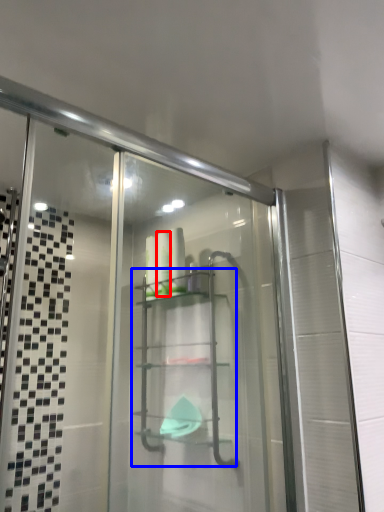
Question: Which point is closer to the camera, toiletry (highlighted by a red box) or glass box (highlighted by a blue box)?

Choices:
 (A) toiletry
 (B) glass box

Answer: (B)